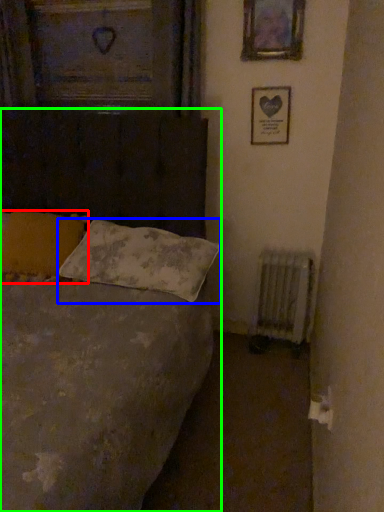
Question: Which is nearer to the pillow (highlighted by a red box)? pillow (highlighted by a blue box) or bed (highlighted by a green box).

Choices:
 (A) pillow
 (B) bed

Answer: (A)